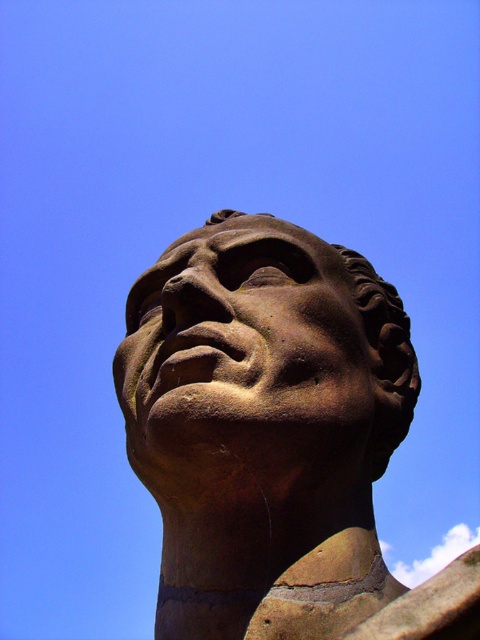
Who is more forward, (156,385) or (336,285)?

Point (156,385) is in front.

I want to click on brown stone head at center, so click(275, 436).

At what (x,y) coordinates should I click in order to perform the action: click on brown stone head at center. Please return your answer as a coordinate pair (x, y). Looking at the image, I should click on (275, 436).